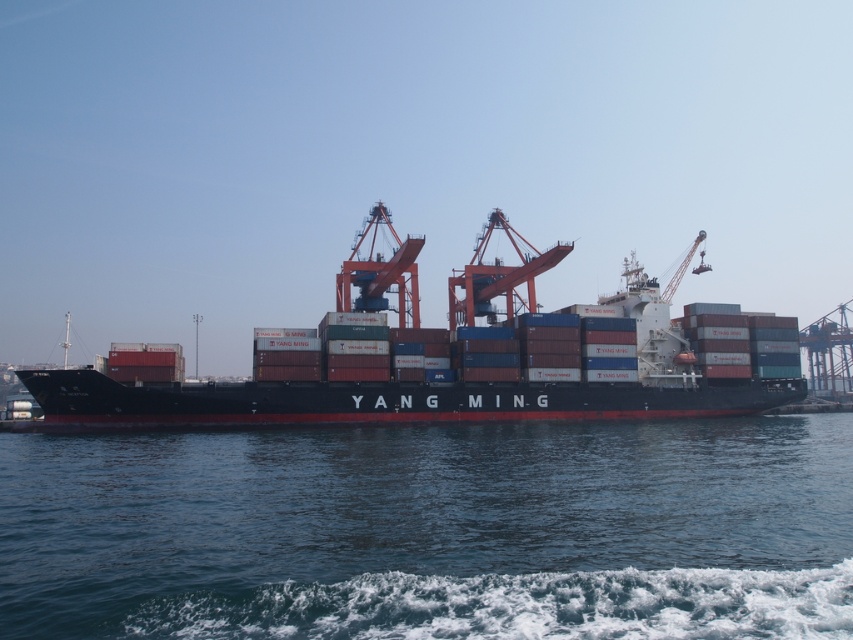
You are standing on the deck of the YANG MING cargo ship and looking towards the port. There is a point marked at coordinates [432,531]. What is located at that point?

At point [432,531] lies blue water at lower center.

You are standing on the deck of the YANG MING cargo ship and want to reach the point at coordinates (x=515, y=433). The ship has a safety zone that requires you to stay at least 100 meters away from the edge. Can you safely reach that point without entering the danger zone?

The point at coordinates (x=515, y=433) is 87.20 meters from the camera, which is within the 100 meters safety zone. Therefore, you can safely reach that point without entering the danger zone.

You are standing on the dock and see the blue water at lower center and the black matte container ship at center. Which object is closer to you?

The blue water at lower center is closer to you because it is in front of the black matte container ship at center.